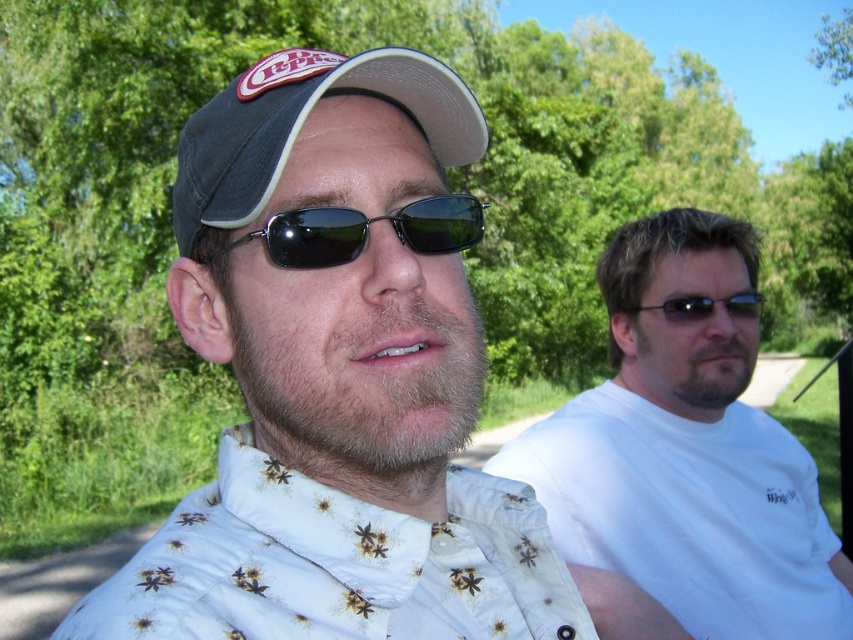
Question: Can you confirm if black matte sunglasses at center is smaller than black reflective sunglasses at right?

Choices:
 (A) yes
 (B) no

Answer: (A)

Question: Which point is farther to the camera?

Choices:
 (A) (397, 218)
 (B) (218, 134)
 (C) (663, 572)

Answer: (C)

Question: Is white matte shirt at right positioned before white floral-patterned shirt at center?

Choices:
 (A) yes
 (B) no

Answer: (B)

Question: Which point appears closest to the camera in this image?

Choices:
 (A) (498, 612)
 (B) (257, 116)

Answer: (B)

Question: Is white matte shirt at right bigger than white floral-patterned shirt at center?

Choices:
 (A) yes
 (B) no

Answer: (A)

Question: Which point is closer to the camera taking this photo?

Choices:
 (A) (210, 620)
 (B) (292, 100)
 (C) (339, 252)

Answer: (A)